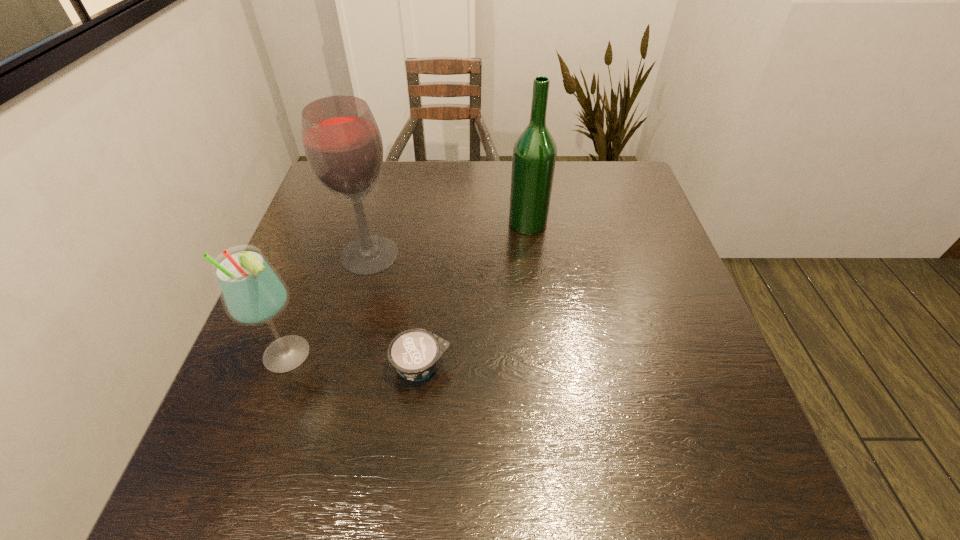
Locate an element on the screen. The image size is (960, 540). free space between the nearest alcohol and the shortest object is located at coordinates (355, 361).

Identify which object is the closest to the nearest alcohol. Please provide its 2D coordinates. Your answer should be formatted as a tuple, i.e. [(x, y)], where the tuple contains the x and y coordinates of a point satisfying the conditions above.

[(414, 353)]

Identify which object is located as the nearest to the shortest alcohol. Please provide its 2D coordinates. Your answer should be formatted as a tuple, i.e. [(x, y)], where the tuple contains the x and y coordinates of a point satisfying the conditions above.

[(414, 353)]

Where is `alcohol that is the closest to the shortest alcohol`? This screenshot has width=960, height=540. alcohol that is the closest to the shortest alcohol is located at coordinates (342, 142).

Identify which alcohol is located as the nearest to the shortest object. Please provide its 2D coordinates. Your answer should be formatted as a tuple, i.e. [(x, y)], where the tuple contains the x and y coordinates of a point satisfying the conditions above.

[(252, 292)]